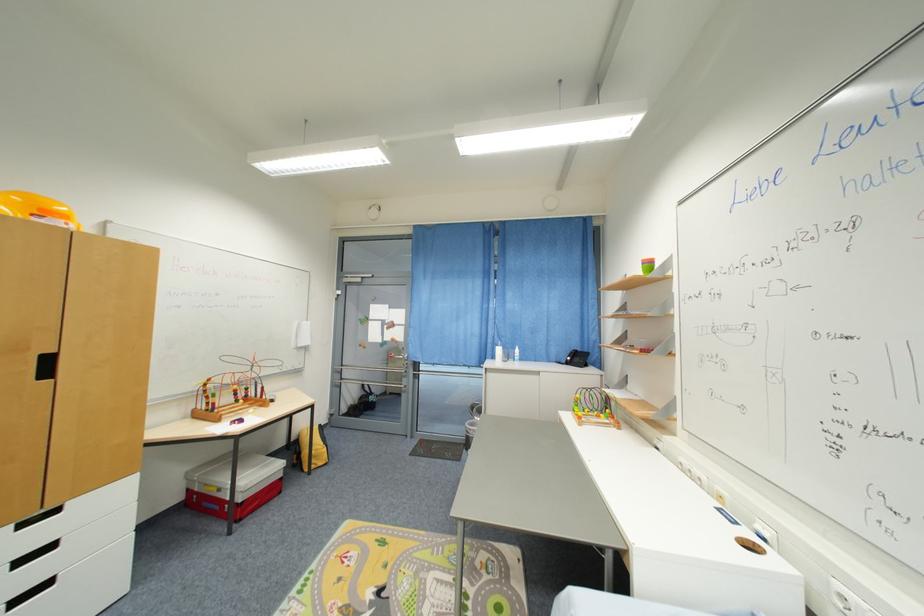
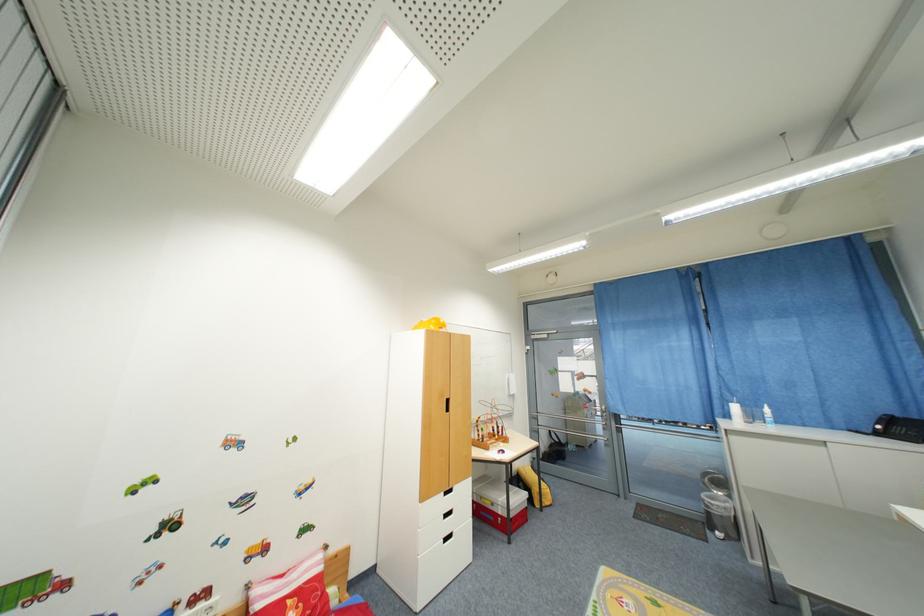
Question: The camera is either moving clockwise (left) or counter-clockwise (right) around the object. The first image is from the beginning of the video and the second image is from the end. Is the camera moving left or right when shooting the video?

Choices:
 (A) Left
 (B) Right

Answer: (B)